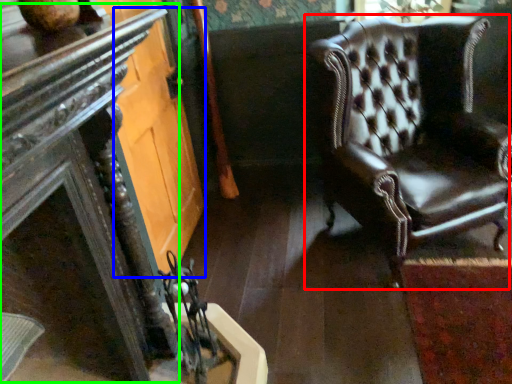
Question: Based on their relative distances, which object is nearer to chair (highlighted by a red box)? Choose from glass door (highlighted by a blue box) and table (highlighted by a green box).

Choices:
 (A) glass door
 (B) table

Answer: (A)